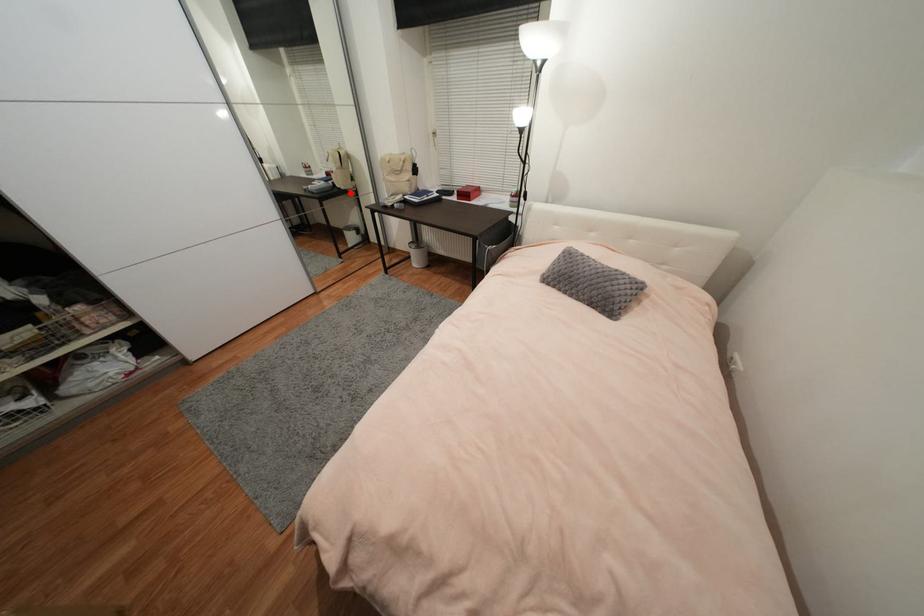
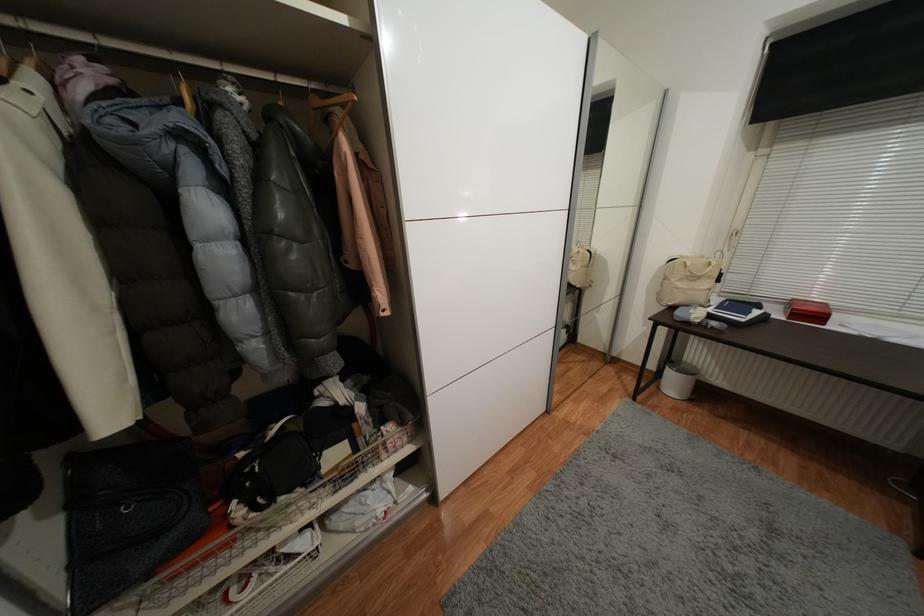
The point at the highlighted location is marked in the first image. Where is the corresponding point in the second image?

(582, 291)